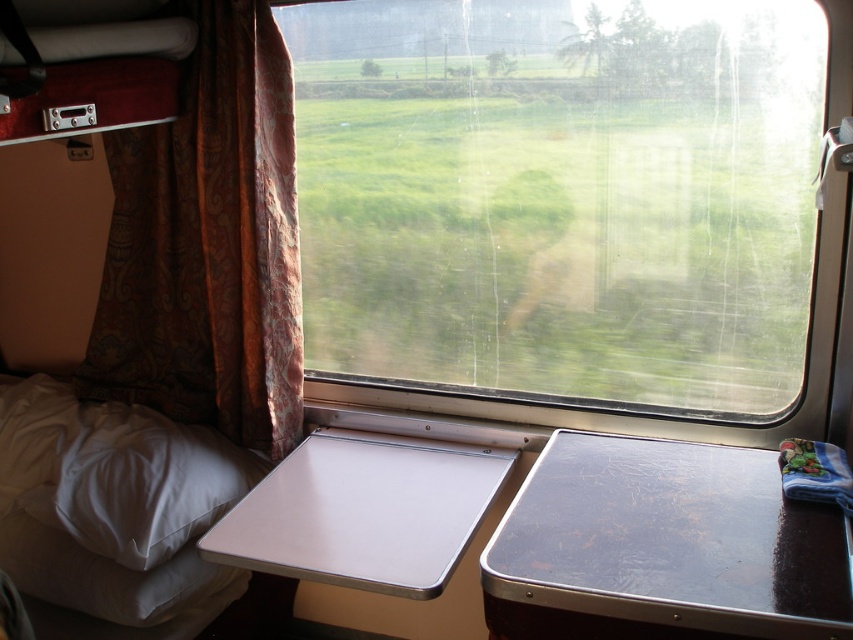
Can you confirm if white soft bed at lower left is taller than white soft pillow at lower left?

Yes, white soft bed at lower left is taller than white soft pillow at lower left.

From the picture: How much distance is there between white soft bed at lower left and white soft pillow at lower left?

white soft bed at lower left is 8.41 centimeters away from white soft pillow at lower left.

Locate an element on the screen. This screenshot has height=640, width=853. white soft bed at lower left is located at coordinates (112, 502).

Can you confirm if shiny brown table at right is smaller than white soft bed at lower left?

Yes, shiny brown table at right is smaller than white soft bed at lower left.

This screenshot has width=853, height=640. What do you see at coordinates (662, 547) in the screenshot? I see `shiny brown table at right` at bounding box center [662, 547].

Describe the element at coordinates (662, 547) in the screenshot. The height and width of the screenshot is (640, 853). I see `shiny brown table at right` at that location.

Locate an element on the screen. The image size is (853, 640). shiny brown table at right is located at coordinates (662, 547).

The width and height of the screenshot is (853, 640). Describe the element at coordinates (207, 244) in the screenshot. I see `brown patterned curtain at left` at that location.

Who is more distant from viewer, (254,49) or (132,506)?

Point (254,49)

Find the location of a particular element. brown patterned curtain at left is located at coordinates (207, 244).